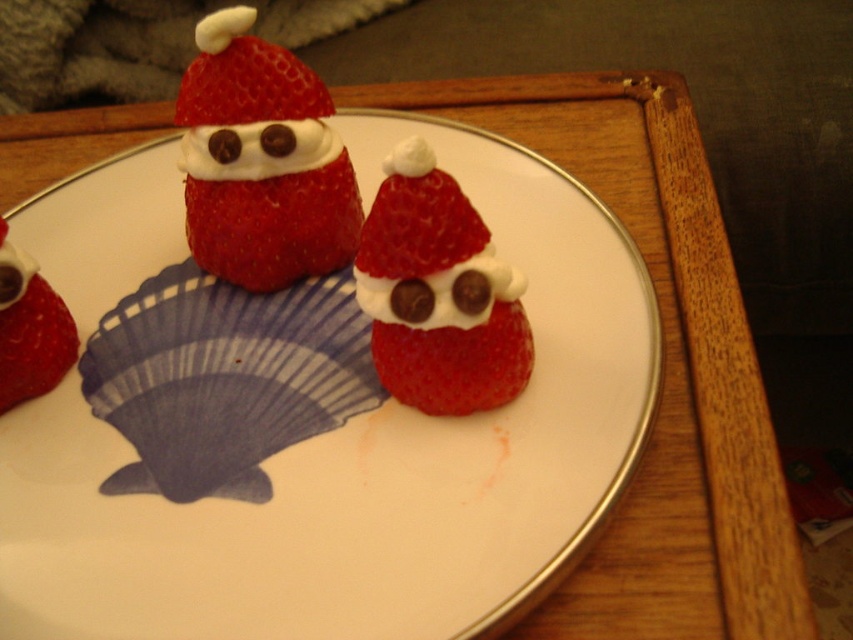
Question: Which of these objects is positioned farthest from the matte white cream at upper left?

Choices:
 (A) shiny red strawberry at center
 (B) matte red strawberry at lower left

Answer: (B)

Question: Does smooth white plate at center have a larger size compared to matte white cream at upper center?

Choices:
 (A) no
 (B) yes

Answer: (B)

Question: In this image, where is matte white cream at upper left located relative to white cream at center?

Choices:
 (A) right
 (B) left

Answer: (A)

Question: Which object is farther from the camera taking this photo?

Choices:
 (A) matte red strawberry at lower left
 (B) matte white cream at upper left
 (C) shiny red strawberry at center

Answer: (B)

Question: In this image, where is white soft blanket at upper left located relative to white cream at center?

Choices:
 (A) left
 (B) right

Answer: (A)

Question: Based on their relative distances, which object is nearer to the white soft blanket at upper left?

Choices:
 (A) white cream frosting at center
 (B) matte white cream at upper center

Answer: (B)